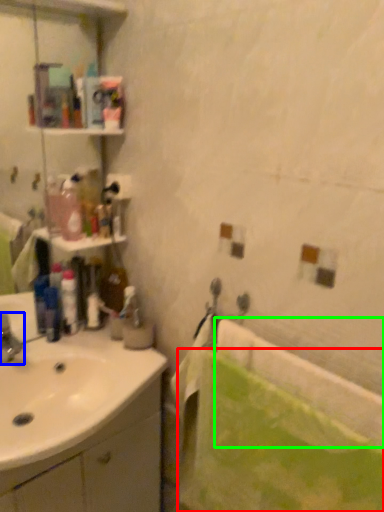
Question: Which object is the farthest from bath towel (highlighted by a red box)? Choose among these: tap (highlighted by a blue box) or bath (highlighted by a green box).

Choices:
 (A) tap
 (B) bath

Answer: (A)